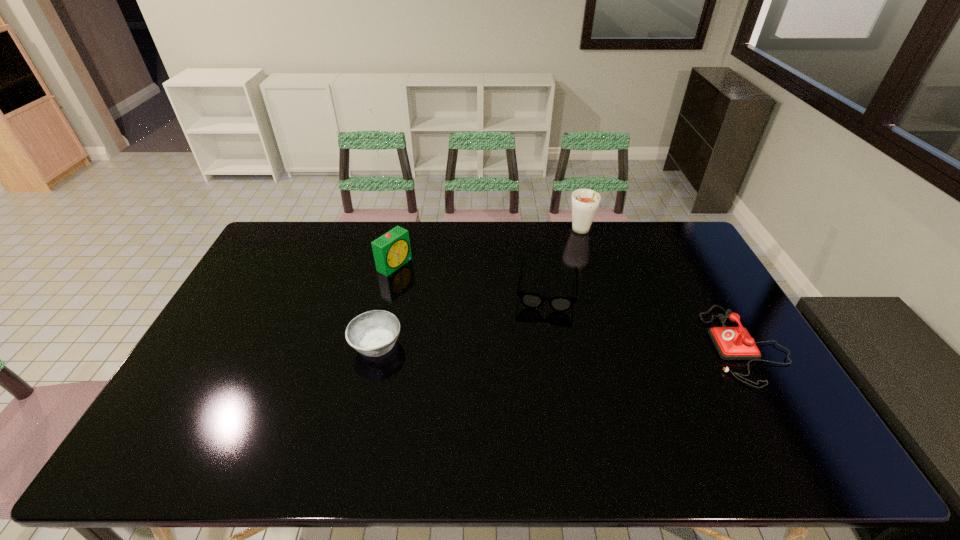
At what (x,y) coordinates should I click in order to perform the action: click on blank space located 0.270m on the dial of the telephone. Please return your answer as a coordinate pair (x, y). Image resolution: width=960 pixels, height=540 pixels. Looking at the image, I should click on (615, 345).

The height and width of the screenshot is (540, 960). In order to click on vacant space located on the arms of the third object from left to right in this screenshot , I will do `click(542, 340)`.

Find the location of `free location located on the arms of the third object from left to right`. free location located on the arms of the third object from left to right is located at coordinates (541, 356).

You are a GUI agent. You are given a task and a screenshot of the screen. Output one action in this format:
    pyautogui.click(x=<x>, y=<y>)
    Task: Click on the free space located 0.080m on the arms of the third object from left to right
    The image size is (960, 540).
    Given the screenshot: What is the action you would take?
    pyautogui.click(x=543, y=333)

Identify the location of free spot located on the front-facing side of the alarm clock. (420, 279).

Where is `free space located on the front-facing side of the alarm clock`? This screenshot has width=960, height=540. free space located on the front-facing side of the alarm clock is located at coordinates (448, 295).

Locate an element on the screen. The width and height of the screenshot is (960, 540). vacant space located on the front-facing side of the alarm clock is located at coordinates (428, 284).

Find the location of a particular element. This screenshot has width=960, height=540. vacant region located on the drink side of the tallest object is located at coordinates (589, 259).

Find the location of a particular element. This screenshot has height=540, width=960. vacant space located on the drink side of the tallest object is located at coordinates (602, 300).

Locate an element on the screen. The height and width of the screenshot is (540, 960). blank space located on the drink side of the tallest object is located at coordinates (606, 313).